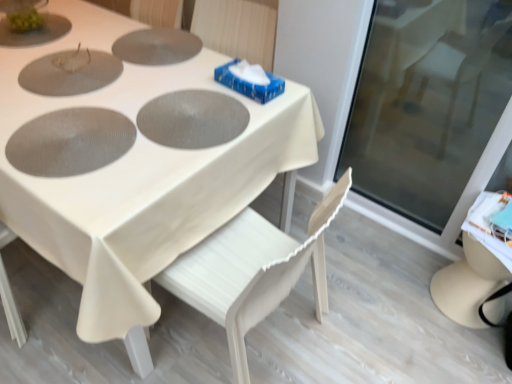
Find the location of `vacant area that lies between matte gray pizza pan at center, which appears as the third pizza pan when viewed from the back, and gray matte pizza pan at center, which is the second pizza pan from front to back`. vacant area that lies between matte gray pizza pan at center, which appears as the third pizza pan when viewed from the back, and gray matte pizza pan at center, which is the second pizza pan from front to back is located at coordinates (131, 124).